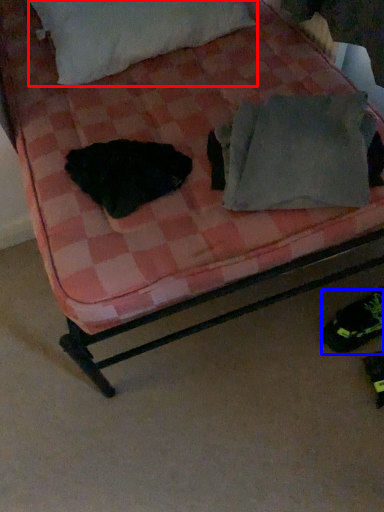
Question: Which of the following is the farthest to the observer, pillow (highlighted by a red box) or footwear (highlighted by a blue box)?

Choices:
 (A) pillow
 (B) footwear

Answer: (A)